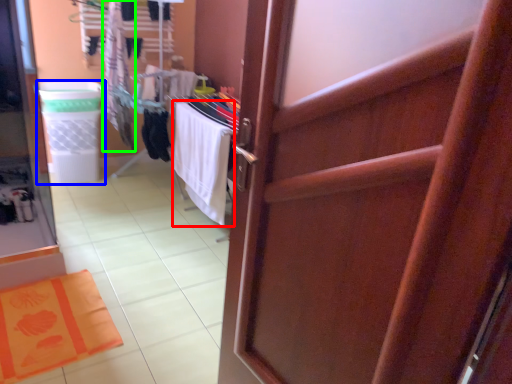
Question: Which object is the farthest from beach towel (highlighted by a red box)? Choose among these: laundry basket (highlighted by a blue box) or clothing (highlighted by a green box).

Choices:
 (A) laundry basket
 (B) clothing

Answer: (A)